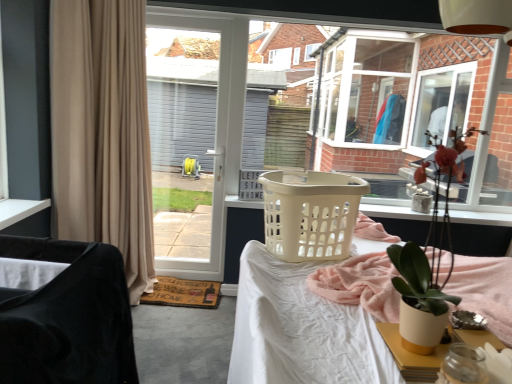
Describe the element at coordinates (189, 139) in the screenshot. I see `white plastic screen door at center` at that location.

What do you see at coordinates (428, 262) in the screenshot? This screenshot has width=512, height=384. I see `matte white pot at right` at bounding box center [428, 262].

What is the approximate width of beige plastic laundry basket at center?

The width of beige plastic laundry basket at center is 51.98 centimeters.

The height and width of the screenshot is (384, 512). Identify the location of transparent plastic laundry basket at center. (413, 104).

At what (x,y) coordinates should I click in order to perform the action: click on white plastic screen door at center. Please return your answer as a coordinate pair (x, y). This screenshot has height=384, width=512. Looking at the image, I should click on (189, 139).

Considering the positions of objects matte white pot at right and white plastic screen door at center in the image provided, who is more to the left, matte white pot at right or white plastic screen door at center?

Positioned to the left is white plastic screen door at center.

How distant is matte white pot at right from white plastic screen door at center?

matte white pot at right is 8.22 meters from white plastic screen door at center.

This screenshot has height=384, width=512. I want to click on screen door lying behind the matte white pot at right, so click(x=189, y=139).

Which point is more distant from viewer, (422, 324) or (215, 159)?

The point (215, 159) is more distant.

Who is smaller, white plastic screen door at center or transparent plastic laundry basket at center?

Smaller between the two is white plastic screen door at center.

Can you tell me how much white plastic screen door at center and transparent plastic laundry basket at center differ in facing direction?

white plastic screen door at center and transparent plastic laundry basket at center are facing 1.41 degrees away from each other.

Is transparent plastic laundry basket at center at the back of white plastic screen door at center?

white plastic screen door at center is not turned away from transparent plastic laundry basket at center.

Is white plastic screen door at center positioned beyond the bounds of transparent plastic laundry basket at center?

Yes.

Is matte white pot at right at the right side of beige plastic laundry basket at center?

Indeed, matte white pot at right is positioned on the right side of beige plastic laundry basket at center.

You are a GUI agent. You are given a task and a screenshot of the screen. Output one action in this format:
    pyautogui.click(x=<x>, y=<y>)
    Task: Click on the basket behind the matte white pot at right
    The width and height of the screenshot is (512, 384).
    Given the screenshot: What is the action you would take?
    tap(311, 215)

Considering the sizes of objects matte white pot at right and beige plastic laundry basket at center in the image provided, who is thinner, matte white pot at right or beige plastic laundry basket at center?

matte white pot at right is thinner.

Considering the points (420, 341) and (339, 207), which point is in front, point (420, 341) or point (339, 207)?

The point (420, 341) is closer.

Measure the distance between transparent plastic laundry basket at center and beige fabric curtain at left.

transparent plastic laundry basket at center and beige fabric curtain at left are 3.20 meters apart.

From a real-world perspective, between transparent plastic laundry basket at center and beige fabric curtain at left, who is vertically higher?

transparent plastic laundry basket at center.

Which point is more distant from viewer, (x=342, y=107) or (x=133, y=214)?

Positioned behind is point (x=342, y=107).

The width and height of the screenshot is (512, 384). Identify the location of window that is behind the beige fabric curtain at left. (413, 104).

Does white plastic desk at center have a smaller size compared to velvet black chair at left?

No, white plastic desk at center is not smaller than velvet black chair at left.

Measure the distance from white plastic desk at center to velvet black chair at left.

They are 21.30 inches apart.

Between point (356, 329) and point (9, 305), which one is positioned behind?

Positioned behind is point (356, 329).

Looking at their sizes, would you say white plastic desk at center is wider or thinner than velvet black chair at left?

Clearly, white plastic desk at center has more width compared to velvet black chair at left.

From a real-world perspective, which is physically below, velvet black chair at left or white plastic screen door at center?

From a 3D spatial view, velvet black chair at left is below.

In terms of width, does velvet black chair at left look wider or thinner when compared to white plastic screen door at center?

Considering their sizes, velvet black chair at left looks broader than white plastic screen door at center.

Does point (81, 370) come behind point (193, 106)?

No, it is not.

Who is bigger, velvet black chair at left or white plastic screen door at center?

Bigger between the two is velvet black chair at left.

Can you confirm if beige fabric curtain at left is smaller than transparent plastic laundry basket at center?

No, beige fabric curtain at left is not smaller than transparent plastic laundry basket at center.

Which of these two, beige fabric curtain at left or transparent plastic laundry basket at center, is thinner?

Thinner between the two is transparent plastic laundry basket at center.

From the image's perspective, relative to transparent plastic laundry basket at center, is beige fabric curtain at left above or below?

Clearly, from the image's perspective, beige fabric curtain at left is below transparent plastic laundry basket at center.

Where is `houseplant below the white plastic screen door at center (from the image's perspective)`? houseplant below the white plastic screen door at center (from the image's perspective) is located at coordinates (428, 262).

I want to click on window located behind the white plastic screen door at center, so click(x=413, y=104).

Estimate the real-world distances between objects in this image. Which object is further from velvet black chair at left, transparent plastic laundry basket at center or matte white pot at right?

transparent plastic laundry basket at center is further to velvet black chair at left.

Estimate the real-world distances between objects in this image. Which object is further from white plastic desk at center, beige fabric curtain at left or beige plastic laundry basket at center?

beige fabric curtain at left lies further to white plastic desk at center than the other object.

When comparing their distances from velvet black chair at left, does white plastic screen door at center or white plastic desk at center seem closer?

The object closer to velvet black chair at left is white plastic desk at center.

Considering their positions, is beige fabric curtain at left positioned further to white plastic desk at center than velvet black chair at left?

beige fabric curtain at left is further to white plastic desk at center.

Considering their positions, is white plastic screen door at center positioned closer to velvet black chair at left than matte white pot at right?

matte white pot at right is closer to velvet black chair at left.

Looking at the image, which one is located closer to matte white pot at right, beige fabric curtain at left or beige plastic laundry basket at center?

Based on the image, beige plastic laundry basket at center appears to be nearer to matte white pot at right.

Looking at the image, which one is located closer to matte white pot at right, transparent plastic laundry basket at center or beige plastic laundry basket at center?

beige plastic laundry basket at center is positioned closer to the anchor matte white pot at right.

Based on their spatial positions, is beige fabric curtain at left or transparent plastic laundry basket at center further from white plastic desk at center?

transparent plastic laundry basket at center lies further to white plastic desk at center than the other object.

Locate an element on the screen. The height and width of the screenshot is (384, 512). basket between white plastic desk at center and transparent plastic laundry basket at center from front to back is located at coordinates (311, 215).

Locate an element on the screen. This screenshot has width=512, height=384. desk positioned between matte white pot at right and beige fabric curtain at left from near to far is located at coordinates (310, 322).

In order to click on desk located between matte white pot at right and transparent plastic laundry basket at center in the depth direction in this screenshot , I will do `click(310, 322)`.

Image resolution: width=512 pixels, height=384 pixels. Identify the location of curtain between beige plastic laundry basket at center and white plastic screen door at center in the front-back direction. (102, 131).